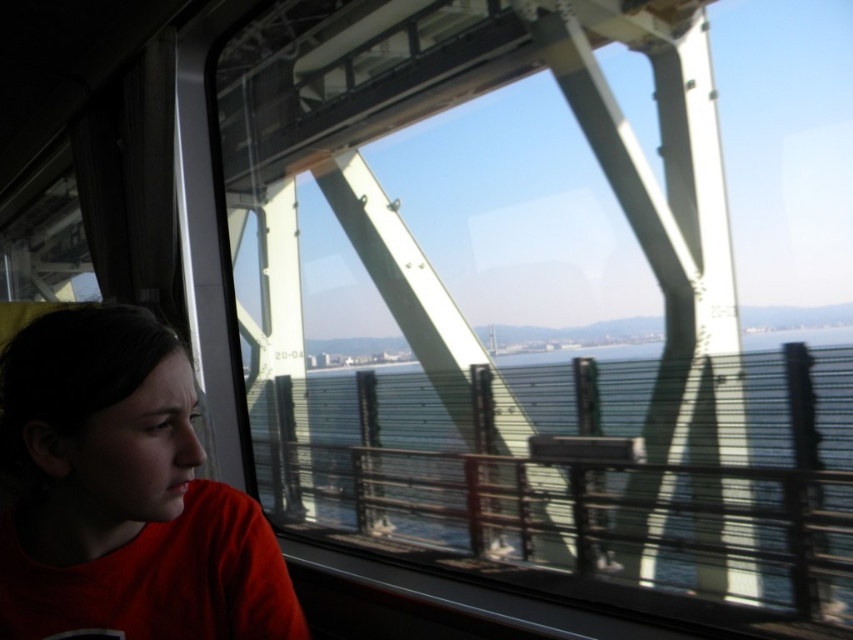
Question: Among these points, which one is farthest from the camera?

Choices:
 (A) (532, 506)
 (B) (114, 324)

Answer: (A)

Question: Which point is farther to the camera?

Choices:
 (A) clear glass water at center
 (B) matte red shirt at left

Answer: (A)

Question: Is clear glass water at center below matte red shirt at left?

Choices:
 (A) yes
 (B) no

Answer: (A)

Question: Can you confirm if clear glass water at center is positioned above matte red shirt at left?

Choices:
 (A) yes
 (B) no

Answer: (B)

Question: Does clear glass water at center have a larger size compared to matte red shirt at left?

Choices:
 (A) yes
 (B) no

Answer: (A)